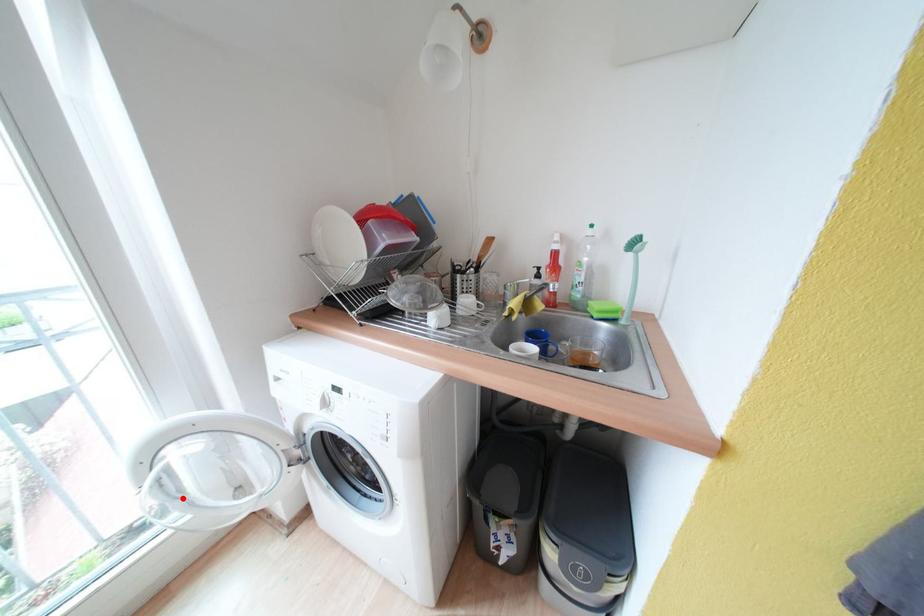
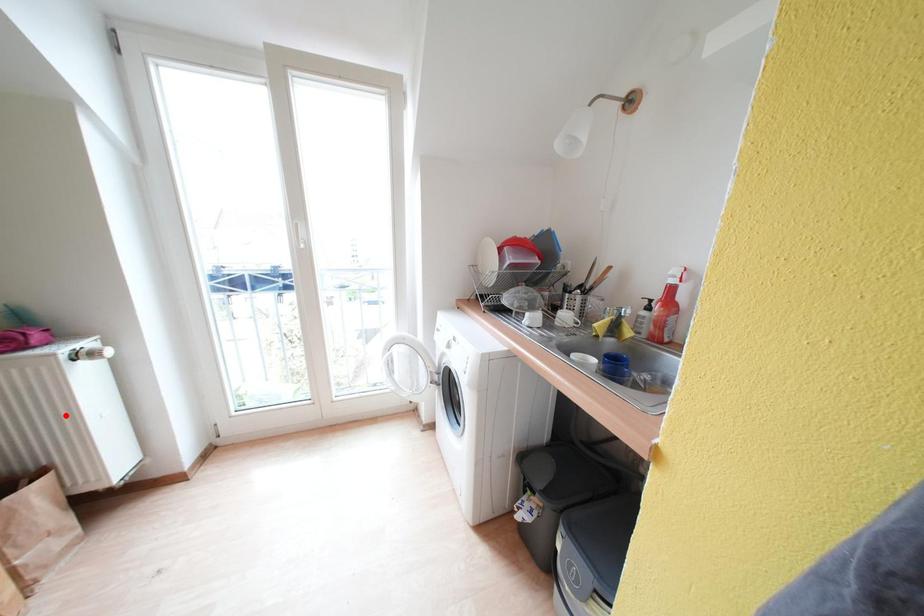
I am providing you with two images of the same scene from different viewpoints. A red point is marked on the first image and another point is marked on the second image. Is the marked point in image1 the same physical position as the marked point in image2?

No